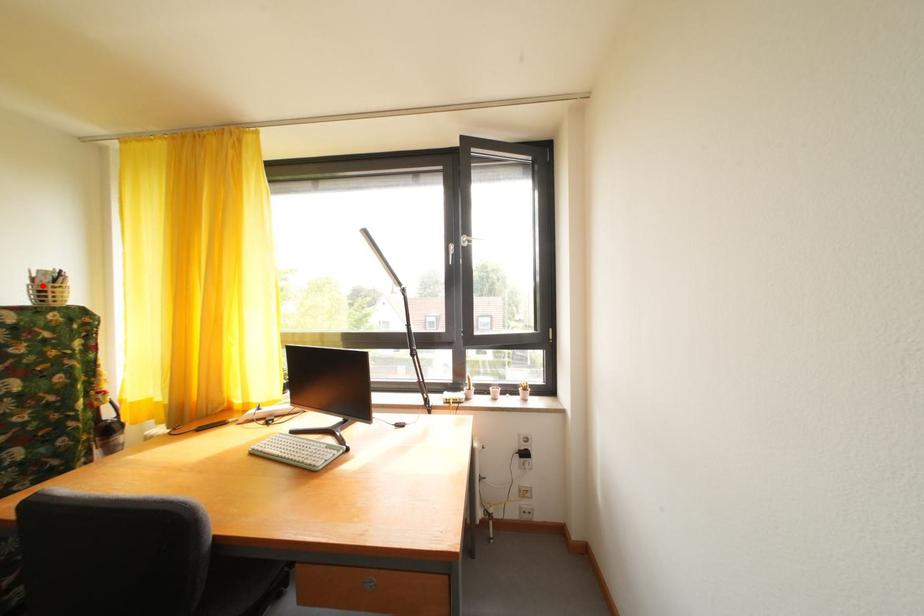
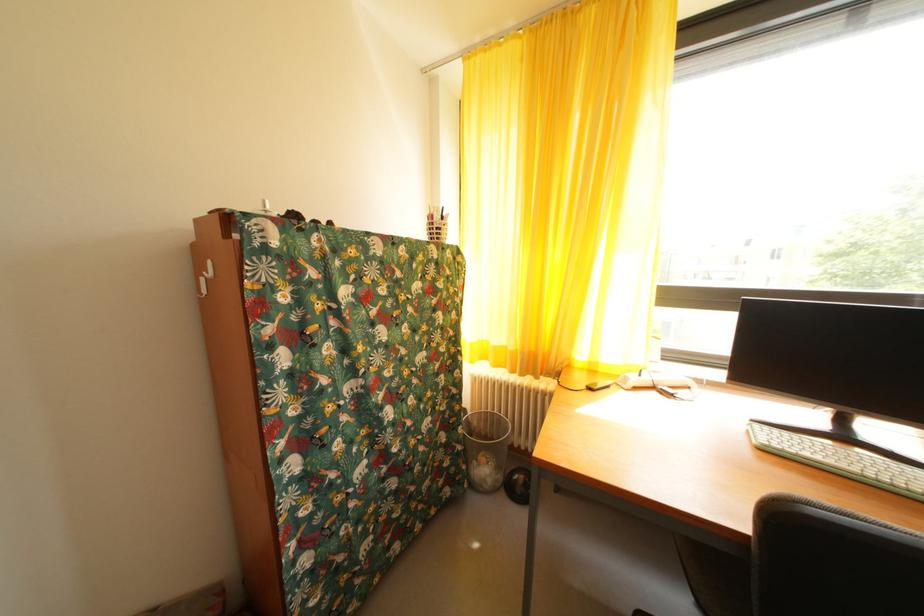
Locate, in the second image, the point that corresponds to the highlighted location in the first image.

(440, 223)